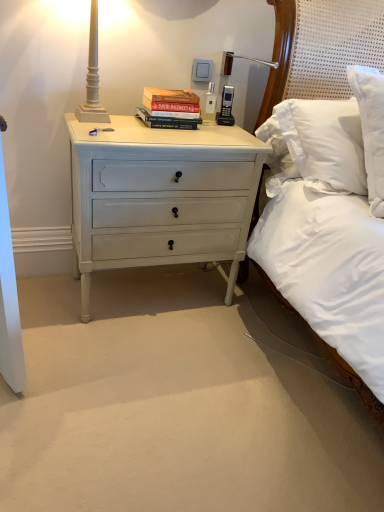
Question: Visually, is matte white lamp at upper left positioned to the left or to the right of white painted wood nightstand at lower left?

Choices:
 (A) right
 (B) left

Answer: (B)

Question: From the image's perspective, relative to white painted wood nightstand at lower left, is matte white lamp at upper left above or below?

Choices:
 (A) above
 (B) below

Answer: (A)

Question: Which of these objects is positioned closest to the white painted wood nightstand at lower left?

Choices:
 (A) hardcover books at center
 (B) matte white lamp at upper left

Answer: (A)

Question: Which of these objects is positioned farthest from the matte white lamp at upper left?

Choices:
 (A) hardcover books at center
 (B) white painted wood nightstand at lower left

Answer: (B)